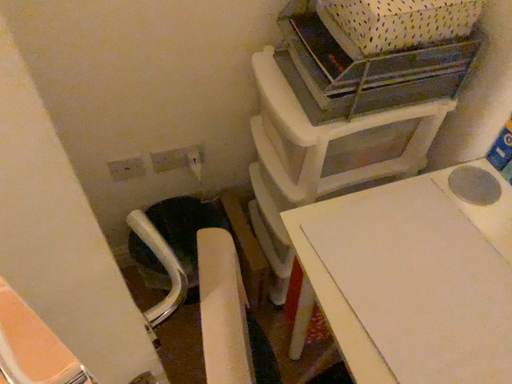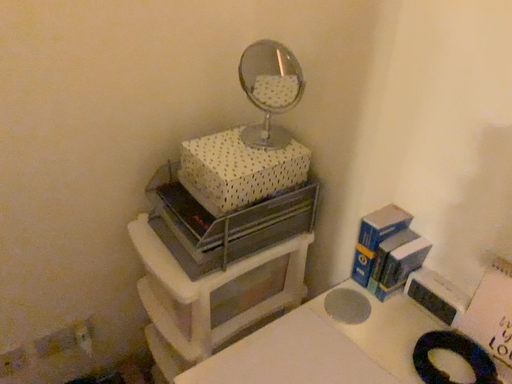
Question: How did the camera likely rotate when shooting the video?

Choices:
 (A) rotated right
 (B) rotated left

Answer: (A)